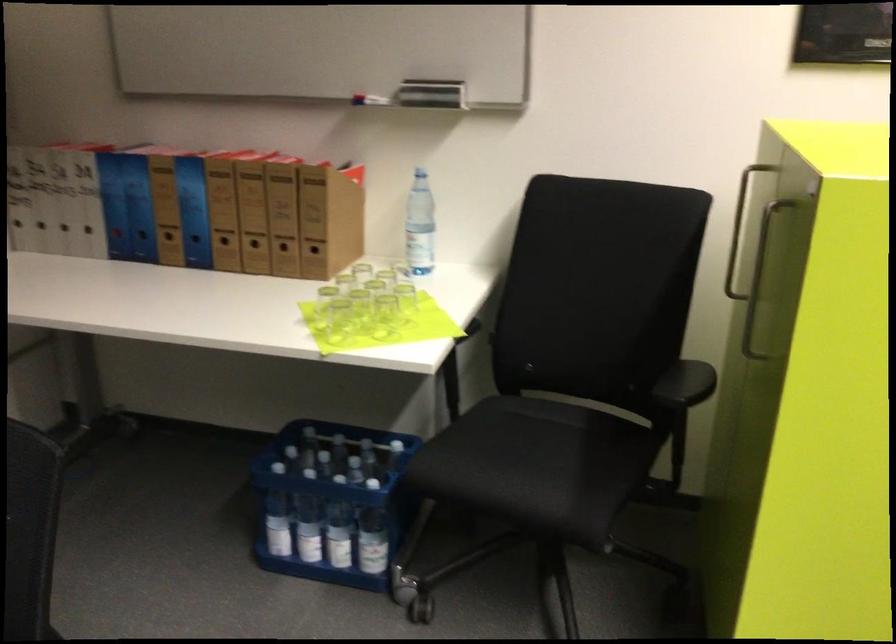
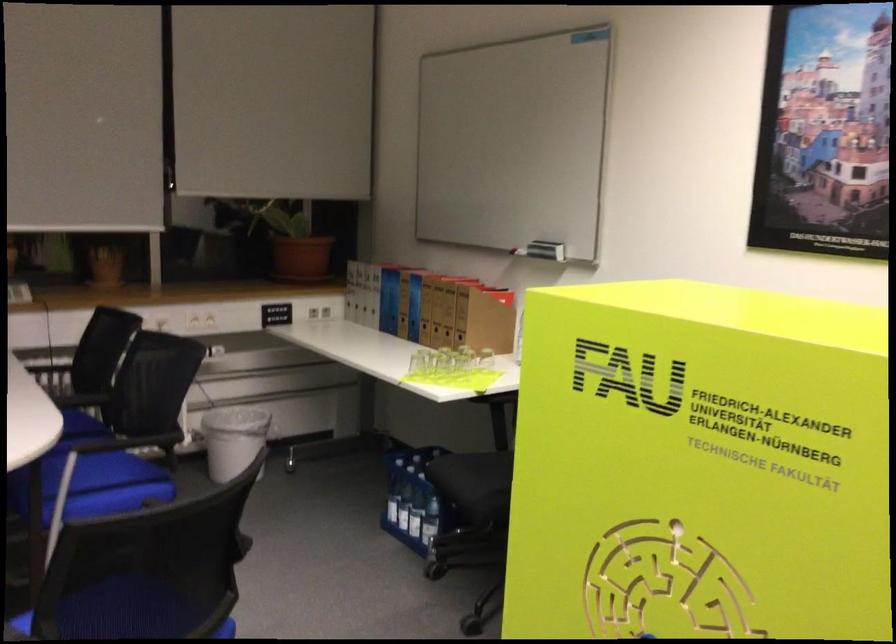
Where in the second image is the point corresponding to point (159, 240) from the first image?

(398, 317)